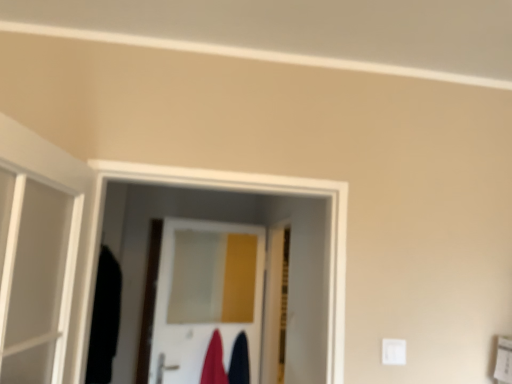
The height and width of the screenshot is (384, 512). Describe the element at coordinates (214, 362) in the screenshot. I see `velvet-like red robe at center, the 1th robe positioned from the left` at that location.

Identify the location of white glossy door at center, the first door in the left-to-right sequence. (206, 296).

Image resolution: width=512 pixels, height=384 pixels. What do you see at coordinates (275, 305) in the screenshot?
I see `wooden door at center, which ranks as the 1th door in right-to-left order` at bounding box center [275, 305].

What do you see at coordinates (239, 361) in the screenshot? I see `velvet dark blue robe at center, placed as the 1th robe when sorted from right to left` at bounding box center [239, 361].

The height and width of the screenshot is (384, 512). In order to click on velvet-like red robe at center, acting as the 2th robe starting from the right in this screenshot , I will do `click(214, 362)`.

How many degrees apart are the facing directions of velvet-like red robe at center, the 1th robe positioned from the left, and wooden door at center, which ranks as the 1th door in right-to-left order?

The angular difference between velvet-like red robe at center, the 1th robe positioned from the left, and wooden door at center, which ranks as the 1th door in right-to-left order, is 106 degrees.

Is point (222, 354) positioned in front of point (278, 357)?

Yes, it is in front of point (278, 357).

Is velvet-like red robe at center, acting as the 2th robe starting from the right, further to camera compared to wooden door at center, which ranks as the 1th door in right-to-left order?

Yes, the depth of velvet-like red robe at center, acting as the 2th robe starting from the right, is greater than that of wooden door at center, which ranks as the 1th door in right-to-left order.

Can you tell me how much white glossy door at center, the first door in the left-to-right sequence, and wooden door at center, which appears as the second door when viewed from the left, differ in facing direction?

The angular difference between white glossy door at center, the first door in the left-to-right sequence, and wooden door at center, which appears as the second door when viewed from the left, is 106 degrees.

The width and height of the screenshot is (512, 384). Identify the location of door below the wooden door at center, which appears as the second door when viewed from the left (from the image's perspective). (206, 296).

Which is in front, point (184, 323) or point (278, 359)?

The point (278, 359) is closer.

Consider the image. Considering the relative sizes of white glossy door at center, which is counted as the 2th door, starting from the right, and wooden door at center, which appears as the second door when viewed from the left, in the image provided, is white glossy door at center, which is counted as the 2th door, starting from the right, bigger than wooden door at center, which appears as the second door when viewed from the left,?

No.

From the image's perspective, starting from the velvet dark blue robe at center, placed as the 1th robe when sorted from right to left, which door is the 2nd one above? Please provide its 2D coordinates.

[(275, 305)]

Based on their positions, is velvet dark blue robe at center, which is counted as the 2th robe, starting from the left, located to the left or right of wooden door at center, which ranks as the 1th door in right-to-left order?

velvet dark blue robe at center, which is counted as the 2th robe, starting from the left, is to the left of wooden door at center, which ranks as the 1th door in right-to-left order.

Is velvet dark blue robe at center, placed as the 1th robe when sorted from right to left, aimed at wooden door at center, which ranks as the 1th door in right-to-left order?

Yes, velvet dark blue robe at center, placed as the 1th robe when sorted from right to left, is facing wooden door at center, which ranks as the 1th door in right-to-left order.

Are velvet dark blue robe at center, which is counted as the 2th robe, starting from the left, and wooden door at center, which ranks as the 1th door in right-to-left order, located far from each other?

No.

Does velvet-like red robe at center, the 1th robe positioned from the left, touch velvet dark blue robe at center, placed as the 1th robe when sorted from right to left?

No, velvet-like red robe at center, the 1th robe positioned from the left, is not in contact with velvet dark blue robe at center, placed as the 1th robe when sorted from right to left.

This screenshot has width=512, height=384. I want to click on robe on the right of velvet-like red robe at center, acting as the 2th robe starting from the right, so click(x=239, y=361).

Between velvet-like red robe at center, acting as the 2th robe starting from the right, and velvet dark blue robe at center, placed as the 1th robe when sorted from right to left, which one has larger size?

With larger size is velvet-like red robe at center, acting as the 2th robe starting from the right.

Considering the relative positions of wooden door at center, which appears as the second door when viewed from the left, and white glossy door at center, the first door in the left-to-right sequence, in the image provided, is wooden door at center, which appears as the second door when viewed from the left, to the left or to the right of white glossy door at center, the first door in the left-to-right sequence,?

From the image, it's evident that wooden door at center, which appears as the second door when viewed from the left, is to the right of white glossy door at center, the first door in the left-to-right sequence.

Is wooden door at center, which ranks as the 1th door in right-to-left order, bigger or smaller than white glossy door at center, which is counted as the 2th door, starting from the right?

In the image, wooden door at center, which ranks as the 1th door in right-to-left order, appears to be larger than white glossy door at center, which is counted as the 2th door, starting from the right.

Is wooden door at center, which ranks as the 1th door in right-to-left order, shorter than white glossy door at center, the first door in the left-to-right sequence?

No.

From the image's perspective, is wooden door at center, which appears as the second door when viewed from the left, located above or below white glossy door at center, the first door in the left-to-right sequence?

Clearly, from the image's perspective, wooden door at center, which appears as the second door when viewed from the left, is above white glossy door at center, the first door in the left-to-right sequence.

Considering the relative sizes of velvet dark blue robe at center, placed as the 1th robe when sorted from right to left, and white glossy door at center, the first door in the left-to-right sequence, in the image provided, is velvet dark blue robe at center, placed as the 1th robe when sorted from right to left, wider than white glossy door at center, the first door in the left-to-right sequence,?

Yes, velvet dark blue robe at center, placed as the 1th robe when sorted from right to left, is wider than white glossy door at center, the first door in the left-to-right sequence.

Visually, is velvet dark blue robe at center, which is counted as the 2th robe, starting from the left, positioned to the left or to the right of white glossy door at center, which is counted as the 2th door, starting from the right?

velvet dark blue robe at center, which is counted as the 2th robe, starting from the left, is positioned on white glossy door at center, which is counted as the 2th door, starting from the right,'s right side.

Does velvet dark blue robe at center, placed as the 1th robe when sorted from right to left, contain white glossy door at center, which is counted as the 2th door, starting from the right?

Actually, white glossy door at center, which is counted as the 2th door, starting from the right, is outside velvet dark blue robe at center, placed as the 1th robe when sorted from right to left.

From a real-world perspective, is velvet dark blue robe at center, which is counted as the 2th robe, starting from the left, on white glossy door at center, the first door in the left-to-right sequence?

Incorrect, from a real-world perspective, velvet dark blue robe at center, which is counted as the 2th robe, starting from the left, is lower than white glossy door at center, the first door in the left-to-right sequence.

Is white glossy door at center, which is counted as the 2th door, starting from the right, oriented away from velvet dark blue robe at center, which is counted as the 2th robe, starting from the left?

That's right, white glossy door at center, which is counted as the 2th door, starting from the right, is facing away from velvet dark blue robe at center, which is counted as the 2th robe, starting from the left.

Would you say white glossy door at center, which is counted as the 2th door, starting from the right, is to the left or to the right of velvet dark blue robe at center, which is counted as the 2th robe, starting from the left, in the picture?

Clearly, white glossy door at center, which is counted as the 2th door, starting from the right, is on the left of velvet dark blue robe at center, which is counted as the 2th robe, starting from the left, in the image.

Which is nearer, (169, 382) or (230, 382)?

The point (169, 382) is more forward.

Between white glossy door at center, which is counted as the 2th door, starting from the right, and velvet dark blue robe at center, placed as the 1th robe when sorted from right to left, which one has more height?

With more height is white glossy door at center, which is counted as the 2th door, starting from the right.

From a real-world perspective, count 2nd doors upward from the velvet-like red robe at center, the 1th robe positioned from the left, and point to it. Please provide its 2D coordinates.

[(275, 305)]

Where is `door behind the wooden door at center, which ranks as the 1th door in right-to-left order`? The height and width of the screenshot is (384, 512). door behind the wooden door at center, which ranks as the 1th door in right-to-left order is located at coordinates (206, 296).

Looking at the image, which one is located further to velvet dark blue robe at center, placed as the 1th robe when sorted from right to left, velvet-like red robe at center, the 1th robe positioned from the left, or wooden door at center, which appears as the second door when viewed from the left?

Among the two, wooden door at center, which appears as the second door when viewed from the left, is located further to velvet dark blue robe at center, placed as the 1th robe when sorted from right to left.

Considering their positions, is velvet-like red robe at center, acting as the 2th robe starting from the right, positioned further to white glossy door at center, the first door in the left-to-right sequence, than wooden door at center, which ranks as the 1th door in right-to-left order?

velvet-like red robe at center, acting as the 2th robe starting from the right, lies further to white glossy door at center, the first door in the left-to-right sequence, than the other object.

When comparing their distances from velvet-like red robe at center, the 1th robe positioned from the left, does velvet dark blue robe at center, placed as the 1th robe when sorted from right to left, or white glossy door at center, which is counted as the 2th door, starting from the right, seem further?

Based on the image, white glossy door at center, which is counted as the 2th door, starting from the right, appears to be further to velvet-like red robe at center, the 1th robe positioned from the left.

Which object lies nearer to the anchor point velvet dark blue robe at center, placed as the 1th robe when sorted from right to left, velvet-like red robe at center, acting as the 2th robe starting from the right, or white glossy door at center, the first door in the left-to-right sequence?

The object closer to velvet dark blue robe at center, placed as the 1th robe when sorted from right to left, is velvet-like red robe at center, acting as the 2th robe starting from the right.

From the image, which object appears to be farther from velvet-like red robe at center, the 1th robe positioned from the left, velvet dark blue robe at center, placed as the 1th robe when sorted from right to left, or wooden door at center, which appears as the second door when viewed from the left?

wooden door at center, which appears as the second door when viewed from the left.

Which object lies further to the anchor point velvet dark blue robe at center, which is counted as the 2th robe, starting from the left, wooden door at center, which ranks as the 1th door in right-to-left order, or velvet-like red robe at center, the 1th robe positioned from the left?

Among the two, wooden door at center, which ranks as the 1th door in right-to-left order, is located further to velvet dark blue robe at center, which is counted as the 2th robe, starting from the left.

Looking at the image, which one is located further to velvet-like red robe at center, the 1th robe positioned from the left, wooden door at center, which ranks as the 1th door in right-to-left order, or white glossy door at center, the first door in the left-to-right sequence?

The object further to velvet-like red robe at center, the 1th robe positioned from the left, is wooden door at center, which ranks as the 1th door in right-to-left order.

Looking at the image, which one is located further to velvet-like red robe at center, acting as the 2th robe starting from the right, white glossy door at center, which is counted as the 2th door, starting from the right, or wooden door at center, which ranks as the 1th door in right-to-left order?

wooden door at center, which ranks as the 1th door in right-to-left order.

Image resolution: width=512 pixels, height=384 pixels. What are the coordinates of `robe between wooden door at center, which appears as the second door when viewed from the left, and velvet dark blue robe at center, placed as the 1th robe when sorted from right to left, in the front-back direction` in the screenshot? It's located at (214, 362).

At what (x,y) coordinates should I click in order to perform the action: click on door between wooden door at center, which ranks as the 1th door in right-to-left order, and velvet dark blue robe at center, placed as the 1th robe when sorted from right to left, in the front-back direction. Please return your answer as a coordinate pair (x, y). Image resolution: width=512 pixels, height=384 pixels. Looking at the image, I should click on (206, 296).

Locate an element on the screen. The width and height of the screenshot is (512, 384). robe between white glossy door at center, which is counted as the 2th door, starting from the right, and velvet dark blue robe at center, placed as the 1th robe when sorted from right to left, from top to bottom is located at coordinates (214, 362).